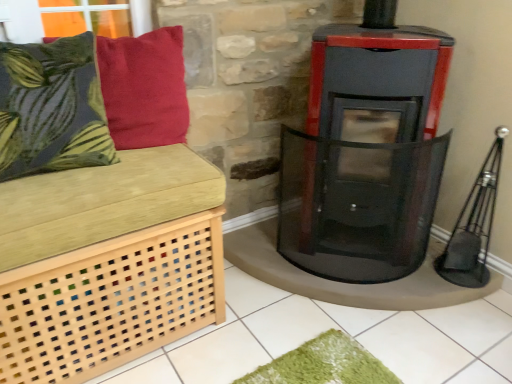
Describe the element at coordinates (366, 150) in the screenshot. I see `black glass wood burning stove at center` at that location.

What do you see at coordinates (94, 226) in the screenshot?
I see `light wood lattice bench at left` at bounding box center [94, 226].

You are a GUI agent. You are given a task and a screenshot of the screen. Output one action in this format:
    pyautogui.click(x=<x>, y=<y>)
    Task: Click on the velvety red pillow at upper left, which is the second pillow from left to right
    
    Given the screenshot: What is the action you would take?
    pyautogui.click(x=144, y=88)

Describe the element at coordinates (144, 88) in the screenshot. The image size is (512, 384). I see `velvety red pillow at upper left, which appears as the first pillow when viewed from the right` at that location.

Identify the location of black glass wood burning stove at center. (366, 150).

Considering the sizes of objects green leafy fabric cushion at left, acting as the first pillow starting from the left, and black glass wood burning stove at center in the image provided, who is bigger, green leafy fabric cushion at left, acting as the first pillow starting from the left, or black glass wood burning stove at center?

black glass wood burning stove at center.

Is green leafy fabric cushion at left, the 2th pillow viewed from the right, facing towards black glass wood burning stove at center?

No, green leafy fabric cushion at left, the 2th pillow viewed from the right, is not turned towards black glass wood burning stove at center.

Which object is positioned more to the right, green leafy fabric cushion at left, acting as the first pillow starting from the left, or black glass wood burning stove at center?

Positioned to the right is black glass wood burning stove at center.

Can you tell me how much green leafy fabric cushion at left, the 2th pillow viewed from the right, and black glass wood burning stove at center differ in facing direction?

They differ by 46 degrees in their facing directions.

From the image's perspective, is black glass wood burning stove at center located above or below green leafy fabric cushion at left, the 2th pillow viewed from the right?

black glass wood burning stove at center is below green leafy fabric cushion at left, the 2th pillow viewed from the right.

Which is less distant, (325, 219) or (46, 164)?

Clearly, point (325, 219) is more distant from the camera than point (46, 164).

Would you consider black glass wood burning stove at center to be distant from green leafy fabric cushion at left, acting as the first pillow starting from the left?

Actually, black glass wood burning stove at center and green leafy fabric cushion at left, acting as the first pillow starting from the left, are a little close together.

Does black glass wood burning stove at center have a greater height compared to green leafy fabric cushion at left, the 2th pillow viewed from the right?

Indeed, black glass wood burning stove at center has a greater height compared to green leafy fabric cushion at left, the 2th pillow viewed from the right.

From the image's perspective, which is below, light wood lattice bench at left or black glass wood burning stove at center?

light wood lattice bench at left is shown below in the image.

Is light wood lattice bench at left facing towards black glass wood burning stove at center?

No, light wood lattice bench at left is not aimed at black glass wood burning stove at center.

Consider the image. Which object is further away from the camera, light wood lattice bench at left or black glass wood burning stove at center?

black glass wood burning stove at center is further away from the camera.

Choose the correct answer: Is light wood lattice bench at left inside black glass wood burning stove at center or outside it?

The correct answer is: outside.

Is velvety red pillow at upper left, which is the second pillow from left to right, oriented away from green leafy fabric cushion at left, acting as the first pillow starting from the left?

velvety red pillow at upper left, which is the second pillow from left to right, does not have its back to green leafy fabric cushion at left, acting as the first pillow starting from the left.

Does point (183, 76) come closer to viewer compared to point (42, 97)?

No, (183, 76) is further to viewer.

In the scene shown: From a real-world perspective, is velvety red pillow at upper left, which appears as the first pillow when viewed from the right, above or below green leafy fabric cushion at left, acting as the first pillow starting from the left?

In terms of real-world spatial position, velvety red pillow at upper left, which appears as the first pillow when viewed from the right, is below green leafy fabric cushion at left, acting as the first pillow starting from the left.

The image size is (512, 384). Identify the location of pillow located above the green leafy fabric cushion at left, acting as the first pillow starting from the left (from the image's perspective). (144, 88).

Does green leafy fabric cushion at left, acting as the first pillow starting from the left, have a lesser height compared to velvety red pillow at upper left, which is the second pillow from left to right?

No, green leafy fabric cushion at left, acting as the first pillow starting from the left, is not shorter than velvety red pillow at upper left, which is the second pillow from left to right.

Is velvety red pillow at upper left, which is the second pillow from left to right, situated inside light wood lattice bench at left or outside?

velvety red pillow at upper left, which is the second pillow from left to right, is outside light wood lattice bench at left.

Is velvety red pillow at upper left, which appears as the first pillow when viewed from the right, aimed at light wood lattice bench at left?

No, velvety red pillow at upper left, which appears as the first pillow when viewed from the right, is not facing towards light wood lattice bench at left.

Is point (129, 102) in front of point (16, 126)?

No, (129, 102) is behind (16, 126).

From a real-world perspective, is velvety red pillow at upper left, which appears as the first pillow when viewed from the right, positioned under light wood lattice bench at left based on gravity?

No.

Which point is more distant from viewer, (27, 283) or (94, 152)?

The point (94, 152) is farther.

From the image's perspective, relative to green leafy fabric cushion at left, the 2th pillow viewed from the right, is light wood lattice bench at left above or below?

light wood lattice bench at left is below green leafy fabric cushion at left, the 2th pillow viewed from the right.

Looking at the image, does light wood lattice bench at left seem bigger or smaller compared to green leafy fabric cushion at left, acting as the first pillow starting from the left?

light wood lattice bench at left is bigger than green leafy fabric cushion at left, acting as the first pillow starting from the left.

Consider the image. Is light wood lattice bench at left next to green leafy fabric cushion at left, acting as the first pillow starting from the left, and touching it?

light wood lattice bench at left and green leafy fabric cushion at left, acting as the first pillow starting from the left, are not in contact.

Locate an element on the screen. The image size is (512, 384). wood burning stove located underneath the green leafy fabric cushion at left, acting as the first pillow starting from the left (from a real-world perspective) is located at coordinates (366, 150).

You are a GUI agent. You are given a task and a screenshot of the screen. Output one action in this format:
    pyautogui.click(x=<x>, y=<y>)
    Task: Click on the 2nd pillow to the left when counting from the black glass wood burning stove at center
    The image size is (512, 384).
    Given the screenshot: What is the action you would take?
    pyautogui.click(x=52, y=108)

Looking at the image, which one is located further to black glass wood burning stove at center, green leafy fabric cushion at left, acting as the first pillow starting from the left, or velvety red pillow at upper left, which is the second pillow from left to right?

Among the two, green leafy fabric cushion at left, acting as the first pillow starting from the left, is located further to black glass wood burning stove at center.

Based on their spatial positions, is light wood lattice bench at left or green leafy fabric cushion at left, acting as the first pillow starting from the left, further from black glass wood burning stove at center?

Among the two, green leafy fabric cushion at left, acting as the first pillow starting from the left, is located further to black glass wood burning stove at center.

Looking at the image, which one is located further to green leafy fabric cushion at left, acting as the first pillow starting from the left, velvety red pillow at upper left, which appears as the first pillow when viewed from the right, or black glass wood burning stove at center?

Among the two, black glass wood burning stove at center is located further to green leafy fabric cushion at left, acting as the first pillow starting from the left.

Based on their spatial positions, is velvety red pillow at upper left, which appears as the first pillow when viewed from the right, or green leafy fabric cushion at left, the 2th pillow viewed from the right, closer to light wood lattice bench at left?

Among the two, green leafy fabric cushion at left, the 2th pillow viewed from the right, is located nearer to light wood lattice bench at left.

Looking at this image, which object lies nearer to the anchor point velvety red pillow at upper left, which appears as the first pillow when viewed from the right, black glass wood burning stove at center or light wood lattice bench at left?

light wood lattice bench at left is closer to velvety red pillow at upper left, which appears as the first pillow when viewed from the right.

Considering their positions, is velvety red pillow at upper left, which is the second pillow from left to right, positioned further to green leafy fabric cushion at left, the 2th pillow viewed from the right, than light wood lattice bench at left?

velvety red pillow at upper left, which is the second pillow from left to right.

Based on their spatial positions, is light wood lattice bench at left or green leafy fabric cushion at left, acting as the first pillow starting from the left, closer to velvety red pillow at upper left, which is the second pillow from left to right?

green leafy fabric cushion at left, acting as the first pillow starting from the left.

Estimate the real-world distances between objects in this image. Which object is closer to velvety red pillow at upper left, which appears as the first pillow when viewed from the right, green leafy fabric cushion at left, acting as the first pillow starting from the left, or black glass wood burning stove at center?

Based on the image, green leafy fabric cushion at left, acting as the first pillow starting from the left, appears to be nearer to velvety red pillow at upper left, which appears as the first pillow when viewed from the right.

Locate an element on the screen. This screenshot has width=512, height=384. pillow between green leafy fabric cushion at left, the 2th pillow viewed from the right, and black glass wood burning stove at center from left to right is located at coordinates [x=144, y=88].

The image size is (512, 384). What are the coordinates of `pillow between velvety red pillow at upper left, which appears as the first pillow when viewed from the right, and light wood lattice bench at left, in the vertical direction` in the screenshot? It's located at click(52, 108).

Identify the location of pillow between light wood lattice bench at left and black glass wood burning stove at center from left to right. This screenshot has width=512, height=384. (x=144, y=88).

Locate an element on the screen. furniture situated between green leafy fabric cushion at left, the 2th pillow viewed from the right, and black glass wood burning stove at center from left to right is located at coordinates (94, 226).